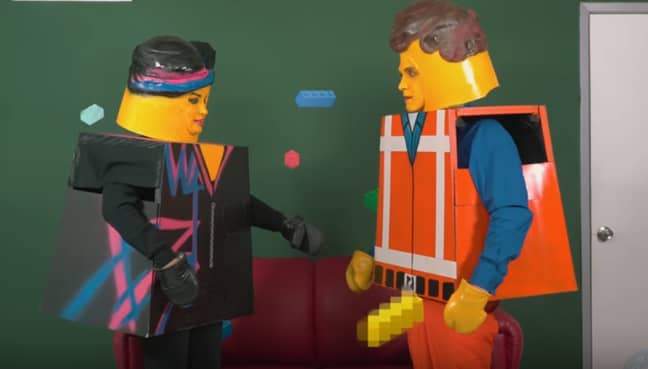
Find the location of a particular element. door knob is located at coordinates (605, 232).